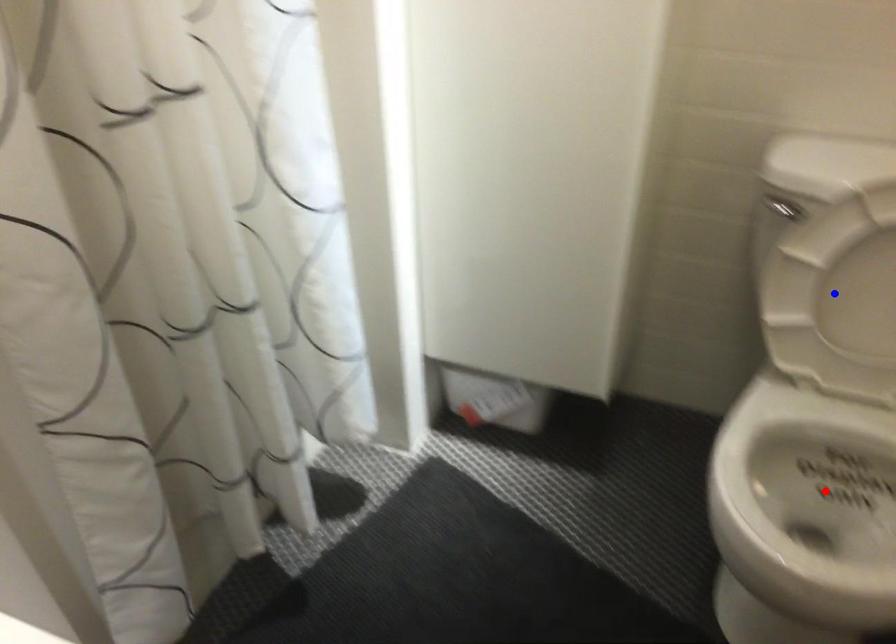
Question: Two points are marked on the image. Which point is closer to the camera?

Choices:
 (A) Blue point is closer.
 (B) Red point is closer.

Answer: (A)